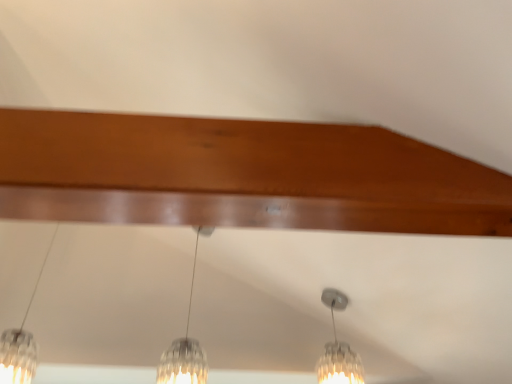
Question: Based on their sizes in the image, would you say clear glass pendant light at center, the third lamp from the left, is bigger or smaller than clear glass pendant light at center, which appears as the second lamp when viewed from the left?

Choices:
 (A) big
 (B) small

Answer: (B)

Question: In the image, is clear glass pendant light at center, the third lamp from the left, on the left side or the right side of clear glass pendant light at center, positioned as the second lamp in right-to-left order?

Choices:
 (A) left
 (B) right

Answer: (B)

Question: Estimate the real-world distances between objects in this image. Which object is farther from the clear glass pendant light at left, placed as the 3th lamp when sorted from right to left?

Choices:
 (A) clear glass pendant light at center, the third lamp from the left
 (B) clear glass pendant light at center, positioned as the second lamp in right-to-left order

Answer: (A)

Question: Which object is positioned farthest from the clear glass pendant light at center, which appears as the second lamp when viewed from the left?

Choices:
 (A) clear glass pendant light at left, placed as the 3th lamp when sorted from right to left
 (B) clear glass pendant light at center, the third lamp from the left

Answer: (B)